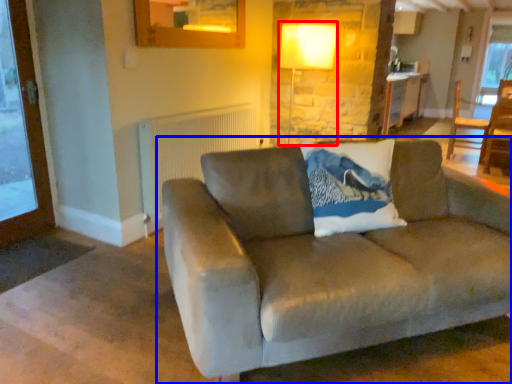
Question: Which object is closer to the camera taking this photo, lamp (highlighted by a red box) or studio couch (highlighted by a blue box)?

Choices:
 (A) lamp
 (B) studio couch

Answer: (B)